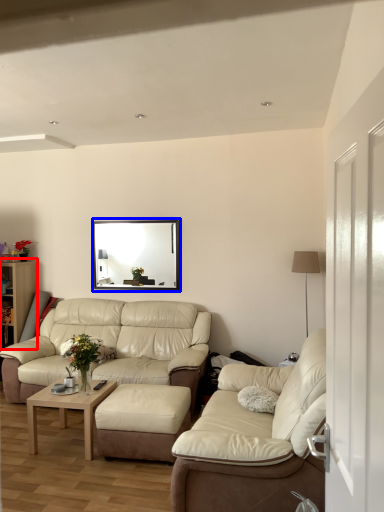
Question: Among these objects, which one is nearest to the camera, dresser (highlighted by a red box) or picture frame (highlighted by a blue box)?

Choices:
 (A) dresser
 (B) picture frame

Answer: (B)